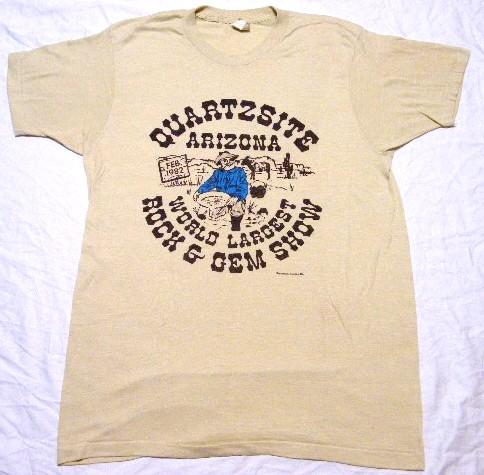
Find the location of `chest`. chest is located at coordinates (229, 179).